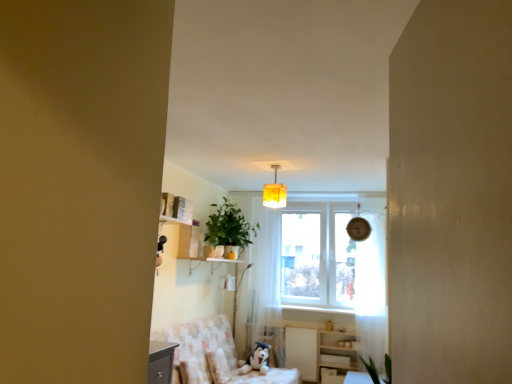
Question: Is wooden table at lower right spatially inside white sheer curtain at center, the 2th curtain when ordered from right to left, or outside of it?

Choices:
 (A) outside
 (B) inside

Answer: (A)

Question: In the image, is wooden table at lower right on the left side or the right side of white sheer curtain at center, the 2th curtain when ordered from right to left?

Choices:
 (A) right
 (B) left

Answer: (A)

Question: Which object is the closest to the yellow fabric lampshade at center?

Choices:
 (A) white sheer curtain at center, positioned as the first curtain in back-to-front order
 (B) green matte plant at center
 (C) fluffy fabric swivel chair at lower center
 (D) white sheer curtain at right, which appears as the first curtain when viewed from the right
 (E) fluffy white pillow at lower center

Answer: (B)

Question: Which is nearer to the yellow fabric lampshade at center?

Choices:
 (A) wooden table at lower right
 (B) white sheer curtain at center, which is the 2th curtain in front-to-back order
 (C) fluffy white pillow at lower center
 (D) white glossy dresser at lower right
 (E) green matte plant at center

Answer: (E)